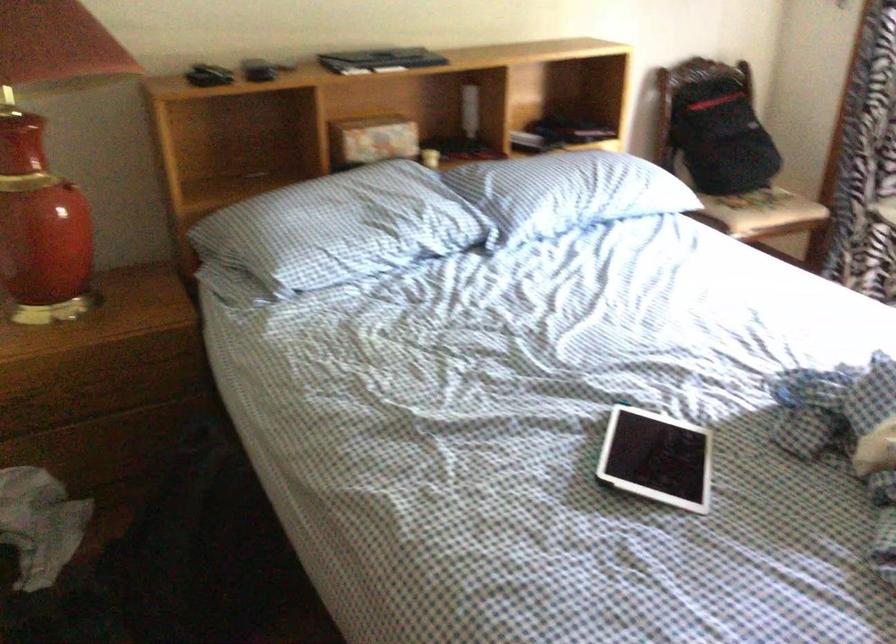
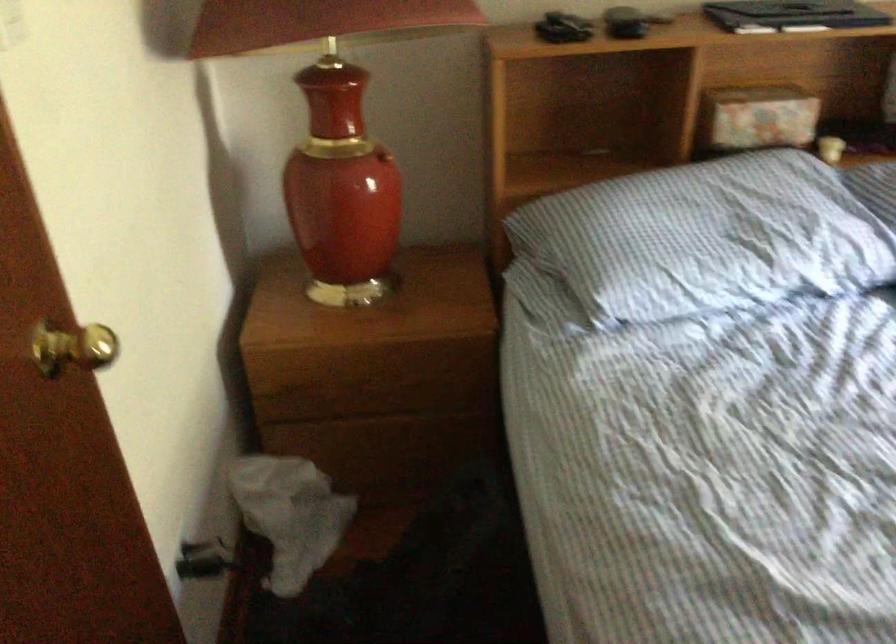
Where in the second image is the point corresponding to point 428,160 from the first image?

(830, 149)